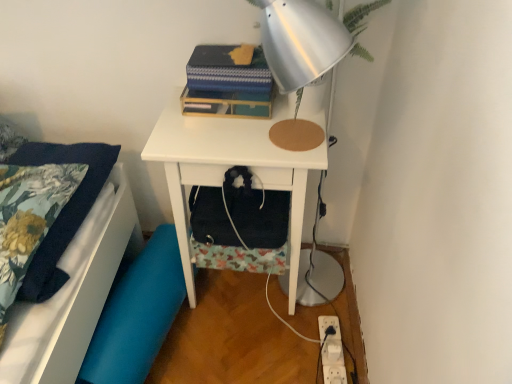
Measure the distance between white plastic electric outlet at lower right and camera.

They are 4.38 feet apart.

What is the approximate width of blue fabric swivel chair at lower left?

8.22 inches.

Identify the location of floral fabric pillowcase at left. (74, 291).

From the image's perspective, between white matte nightstand at center and blue textured notebook at upper center, which one is located above?

blue textured notebook at upper center is shown above in the image.

Does white matte nightstand at center come in front of blue textured notebook at upper center?

Yes, white matte nightstand at center is in front of blue textured notebook at upper center.

From a real-world perspective, which object rests below the other?

In real-world perspective, white matte nightstand at center is lower.

Between white matte nightstand at center and blue textured notebook at upper center, which one has less height?

blue textured notebook at upper center.

Where is `electric outlet that is on the right side of white matte nightstand at center`? electric outlet that is on the right side of white matte nightstand at center is located at coordinates (332, 352).

Is white plastic electric outlet at lower right not within white matte nightstand at center?

Absolutely, white plastic electric outlet at lower right is external to white matte nightstand at center.

From the image's perspective, is white plastic electric outlet at lower right above or below white matte nightstand at center?

From the image's perspective, white plastic electric outlet at lower right appears below white matte nightstand at center.

Looking at this image, from a real-world perspective, is floral fabric pillowcase at left below blue textured notebook at upper center?

Yes.

Is floral fabric pillowcase at left oriented towards blue textured notebook at upper center?

No, floral fabric pillowcase at left is not turned towards blue textured notebook at upper center.

Is floral fabric pillowcase at left inside or outside of blue textured notebook at upper center?

The correct answer is: outside.

Considering the sizes of objects floral fabric pillowcase at left and blue textured notebook at upper center in the image provided, who is bigger, floral fabric pillowcase at left or blue textured notebook at upper center?

floral fabric pillowcase at left is bigger.

Can you confirm if floral fabric pillowcase at left is positioned to the right of silver metallic lamp at upper center?

No.

From a real-world perspective, which is physically below, floral fabric pillowcase at left or silver metallic lamp at upper center?

floral fabric pillowcase at left.

Who is bigger, floral fabric pillowcase at left or silver metallic lamp at upper center?

With larger size is floral fabric pillowcase at left.

Does floral fabric pillowcase at left lie in front of silver metallic lamp at upper center?

Yes, it is in front of silver metallic lamp at upper center.

From the picture: Could you tell me if blue fabric swivel chair at lower left is facing blue textured notebook at upper center?

No, blue fabric swivel chair at lower left is not facing towards blue textured notebook at upper center.

Are blue fabric swivel chair at lower left and blue textured notebook at upper center beside each other?

blue fabric swivel chair at lower left and blue textured notebook at upper center are clearly separated.

In the scene shown: Which is closer, (170, 277) or (234, 53)?

Point (170, 277) is farther from the camera than point (234, 53).

Relative to blue textured notebook at upper center, is blue fabric swivel chair at lower left in front or behind?

blue fabric swivel chair at lower left is positioned farther from the viewer than blue textured notebook at upper center.

Does silver metallic lamp at upper center have a lesser width compared to blue fabric swivel chair at lower left?

In fact, silver metallic lamp at upper center might be wider than blue fabric swivel chair at lower left.

Is silver metallic lamp at upper center positioned beyond the bounds of blue fabric swivel chair at lower left?

silver metallic lamp at upper center lies outside blue fabric swivel chair at lower left's area.

From the image's perspective, which one is positioned higher, silver metallic lamp at upper center or blue fabric swivel chair at lower left?

silver metallic lamp at upper center, from the image's perspective.

How different are the orientations of silver metallic lamp at upper center and blue fabric swivel chair at lower left in degrees?

83.4 degrees separate the facing orientations of silver metallic lamp at upper center and blue fabric swivel chair at lower left.

Is blue fabric swivel chair at lower left turned away from silver metallic lamp at upper center?

That's not correct — blue fabric swivel chair at lower left is not looking away from silver metallic lamp at upper center.

From a real-world perspective, is blue fabric swivel chair at lower left above or below silver metallic lamp at upper center?

From a real-world perspective, blue fabric swivel chair at lower left is physically below silver metallic lamp at upper center.

In terms of width, does blue fabric swivel chair at lower left look wider or thinner when compared to silver metallic lamp at upper center?

Clearly, blue fabric swivel chair at lower left has less width compared to silver metallic lamp at upper center.

Is silver metallic lamp at upper center located within blue fabric swivel chair at lower left?

No, blue fabric swivel chair at lower left does not contain silver metallic lamp at upper center.

Where is `nightstand located in front of the blue textured notebook at upper center`? nightstand located in front of the blue textured notebook at upper center is located at coordinates (229, 167).

This screenshot has height=384, width=512. Find the location of `nightstand that is on the left side of white plastic electric outlet at lower right`. nightstand that is on the left side of white plastic electric outlet at lower right is located at coordinates tap(229, 167).

Which object lies further to the anchor point floral fabric pillowcase at left, silver metallic lamp at upper center or blue textured notebook at upper center?

silver metallic lamp at upper center.

Estimate the real-world distances between objects in this image. Which object is further from blue fabric swivel chair at lower left, white plastic electric outlet at lower right or blue textured notebook at upper center?

Based on the image, blue textured notebook at upper center appears to be further to blue fabric swivel chair at lower left.

Based on their spatial positions, is blue fabric swivel chair at lower left or white plastic electric outlet at lower right further from blue textured notebook at upper center?

white plastic electric outlet at lower right is positioned further to the anchor blue textured notebook at upper center.

Estimate the real-world distances between objects in this image. Which object is closer to blue textured notebook at upper center, white plastic electric outlet at lower right or blue fabric swivel chair at lower left?

blue fabric swivel chair at lower left lies closer to blue textured notebook at upper center than the other object.

Which object lies nearer to the anchor point white matte nightstand at center, blue fabric swivel chair at lower left or white plastic electric outlet at lower right?

Based on the image, blue fabric swivel chair at lower left appears to be nearer to white matte nightstand at center.

From the image, which object appears to be farther from white plastic electric outlet at lower right, blue textured notebook at upper center or white matte nightstand at center?

blue textured notebook at upper center is further to white plastic electric outlet at lower right.

From the image, which object appears to be nearer to white plastic electric outlet at lower right, blue fabric swivel chair at lower left or blue textured notebook at upper center?

blue fabric swivel chair at lower left lies closer to white plastic electric outlet at lower right than the other object.

Based on their spatial positions, is blue fabric swivel chair at lower left or blue textured notebook at upper center further from white matte nightstand at center?

blue fabric swivel chair at lower left lies further to white matte nightstand at center than the other object.

Locate an element on the screen. The height and width of the screenshot is (384, 512). book between silver metallic lamp at upper center and white plastic electric outlet at lower right in the vertical direction is located at coordinates (228, 83).

Identify the location of book located between floral fabric pillowcase at left and white plastic electric outlet at lower right in the left-right direction. The height and width of the screenshot is (384, 512). (228, 83).

Locate an element on the screen. The height and width of the screenshot is (384, 512). swivel chair that lies between silver metallic lamp at upper center and white plastic electric outlet at lower right from top to bottom is located at coordinates (137, 314).

Find the location of a particular element. swivel chair between floral fabric pillowcase at left and silver metallic lamp at upper center in the horizontal direction is located at coordinates (137, 314).